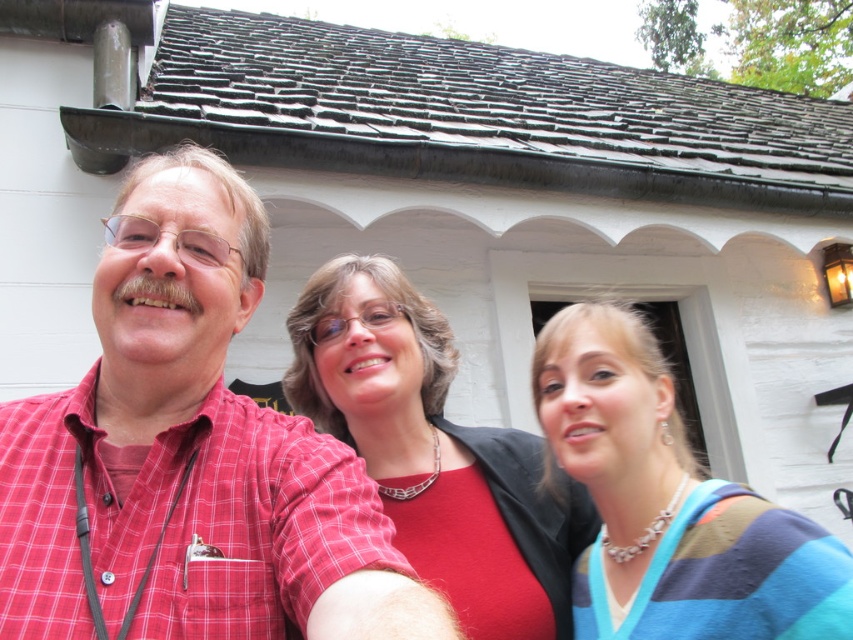
Question: Does striped sweater at center come in front of matte red blouse at center?

Choices:
 (A) yes
 (B) no

Answer: (A)

Question: Which point is closer to the camera?

Choices:
 (A) red checkered shirt at center
 (B) matte red blouse at center

Answer: (A)

Question: Among these points, which one is nearest to the camera?

Choices:
 (A) (767, 620)
 (B) (3, 636)
 (C) (397, 324)

Answer: (B)

Question: Can you confirm if striped sweater at center is positioned to the left of matte red blouse at center?

Choices:
 (A) yes
 (B) no

Answer: (B)

Question: Is striped sweater at center behind matte red blouse at center?

Choices:
 (A) yes
 (B) no

Answer: (B)

Question: Which point is closer to the camera taking this photo?

Choices:
 (A) (618, 573)
 (B) (131, 493)
 (C) (368, 364)

Answer: (B)